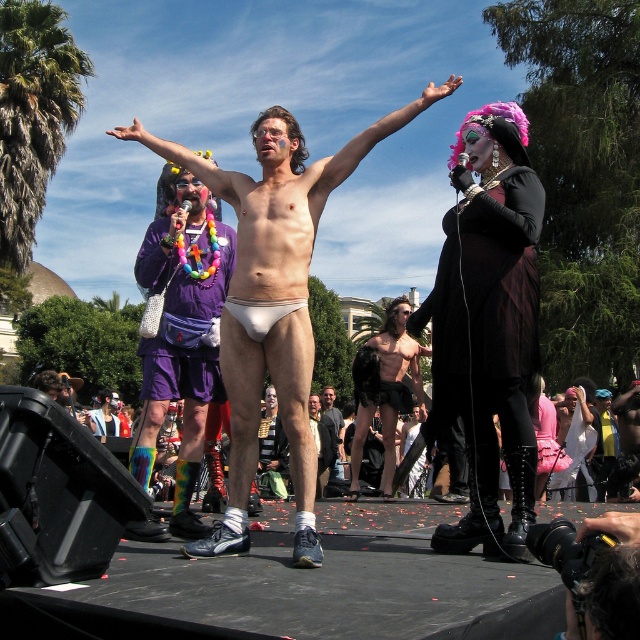
Does shiny black shorts at center appear over smooth white underwear at center?

Yes.

Can you confirm if shiny black shorts at center is positioned to the left of smooth white underwear at center?

Incorrect, shiny black shorts at center is not on the left side of smooth white underwear at center.

Is point (364, 422) more distant than point (333, 442)?

No, it is in front of (333, 442).

Locate an element on the screen. Image resolution: width=640 pixels, height=640 pixels. shiny black shorts at center is located at coordinates (385, 388).

Is black leather dress at center to the right of smooth black shorts at center from the viewer's perspective?

Yes, black leather dress at center is to the right of smooth black shorts at center.

Is point (515, 273) in front of point (339, 470)?

That is True.

The image size is (640, 640). Describe the element at coordinates (488, 280) in the screenshot. I see `black leather dress at center` at that location.

Identify the location of black leather dress at center. This screenshot has height=640, width=640. (488, 280).

Does black leather dress at center appear over purple fabric lei at left?

Yes.

Is black leather dress at center below purple fabric lei at left?

Incorrect, black leather dress at center is not positioned below purple fabric lei at left.

Between point (524, 348) and point (177, 304), which one is positioned in front?

Point (524, 348) is more forward.

Locate an element on the screen. The image size is (640, 640). black leather dress at center is located at coordinates (488, 280).